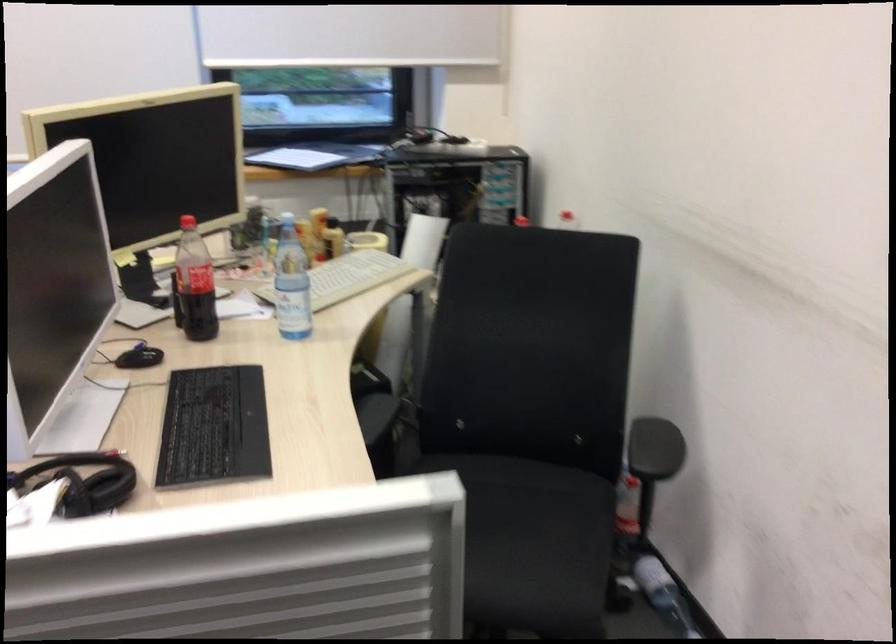
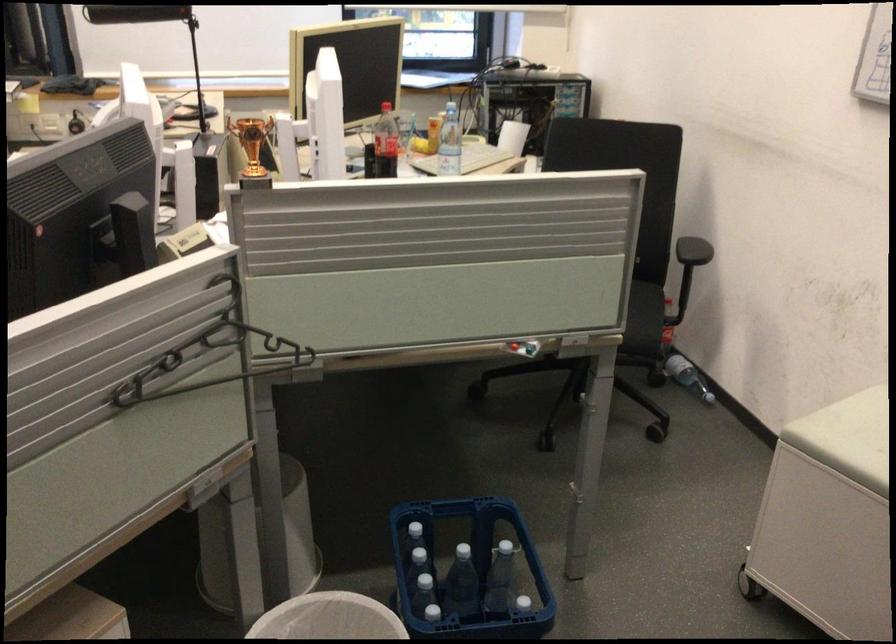
Question: I am providing you with two images of the same scene from different viewpoints. Which of the following objects are not visible in image2?

Choices:
 (A) white trash can
 (B) black keyboard
 (C) black graduation cap
 (D) red button

Answer: (B)